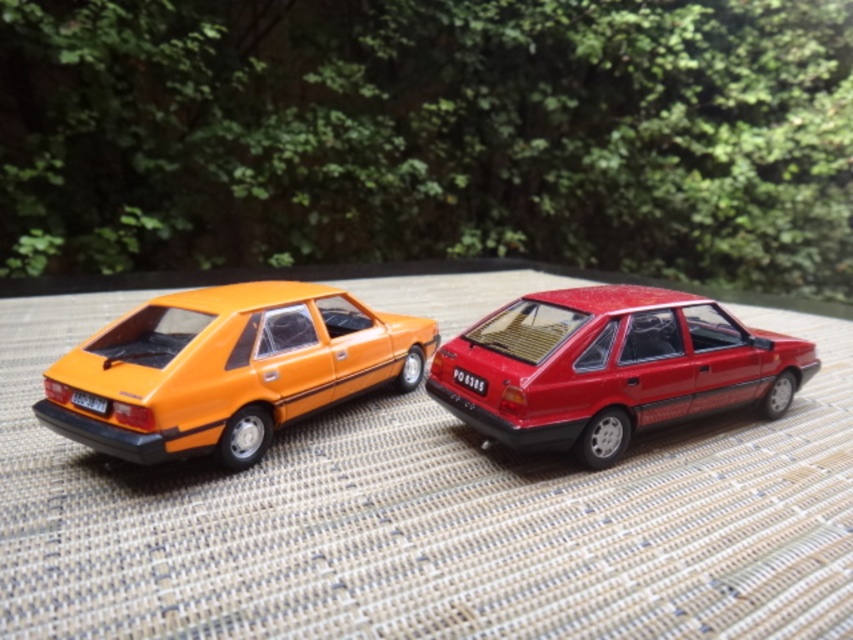
You are a collector who wants to arrange two model cars on a display mat. You have a white plastic license plate at lower left and a red plastic license plate at center. According to the current arrangement, which license plate is positioned to the left of the other?

The white plastic license plate at lower left is positioned to the left of the red plastic license plate at center.